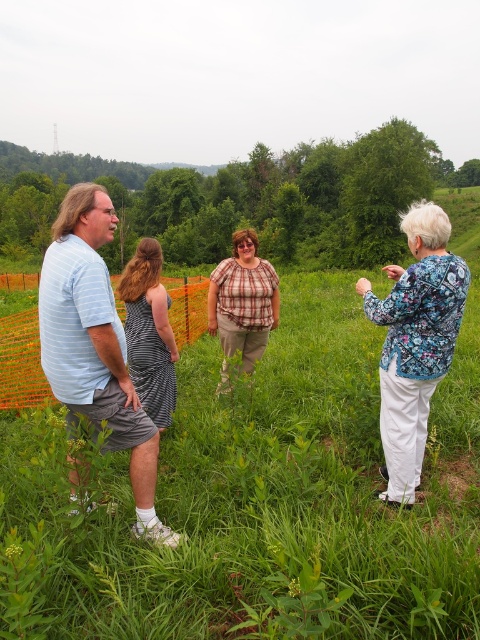
Question: Among these points, which one is nearest to the camera?

Choices:
 (A) (22, 324)
 (B) (251, 252)

Answer: (B)

Question: Is striped fabric dress at center positioned at the back of orange mesh fence at left?

Choices:
 (A) yes
 (B) no

Answer: (B)

Question: Estimate the real-world distances between objects in this image. Which object is farther from the striped fabric dress at center?

Choices:
 (A) floral print blouse at right
 (B) plaid fabric shirt at center
 (C) orange mesh fence at left
 (D) green grass at center

Answer: (C)

Question: Does green grass at center appear over plaid fabric shirt at center?

Choices:
 (A) no
 (B) yes

Answer: (A)

Question: Which point is closer to the camera taking this photo?

Choices:
 (A) (118, 288)
 (B) (200, 579)
 (C) (259, 346)
 (D) (406, 392)

Answer: (B)

Question: Is green grass at center positioned at the back of plaid fabric shirt at center?

Choices:
 (A) yes
 (B) no

Answer: (B)